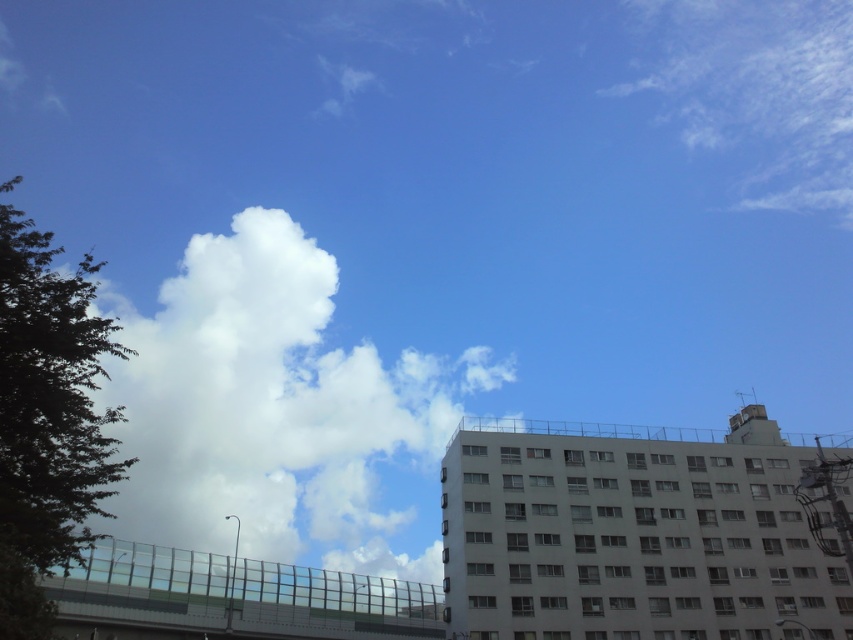
Question: Estimate the real-world distances between objects in this image. Which object is farther from the white fluffy cloud at upper right?

Choices:
 (A) transparent glass overpass at lower left
 (B) white fluffy cloud at upper left

Answer: (A)

Question: Considering the real-world distances, which object is farthest from the white fluffy cloud at upper left?

Choices:
 (A) white fluffy cloud at upper right
 (B) transparent glass overpass at lower left

Answer: (A)

Question: Considering the real-world distances, which object is farthest from the white fluffy cloud at upper right?

Choices:
 (A) white fluffy cloud at upper left
 (B) transparent glass overpass at lower left

Answer: (B)

Question: Does white fluffy cloud at upper left come behind white fluffy cloud at upper right?

Choices:
 (A) yes
 (B) no

Answer: (B)

Question: Does white fluffy cloud at upper left appear over white fluffy cloud at upper right?

Choices:
 (A) no
 (B) yes

Answer: (A)

Question: Does white fluffy cloud at upper right lie behind transparent glass overpass at lower left?

Choices:
 (A) yes
 (B) no

Answer: (A)